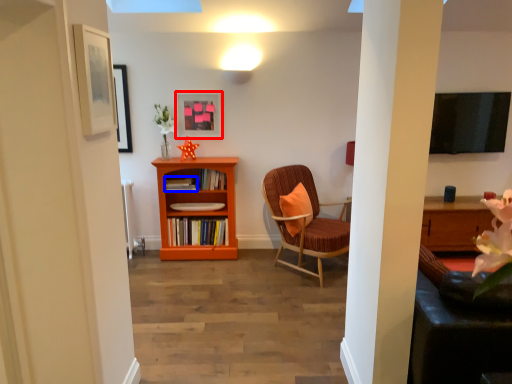
Question: Which object appears closest to the camera in this image, picture frame (highlighted by a red box) or book (highlighted by a blue box)?

Choices:
 (A) picture frame
 (B) book

Answer: (B)